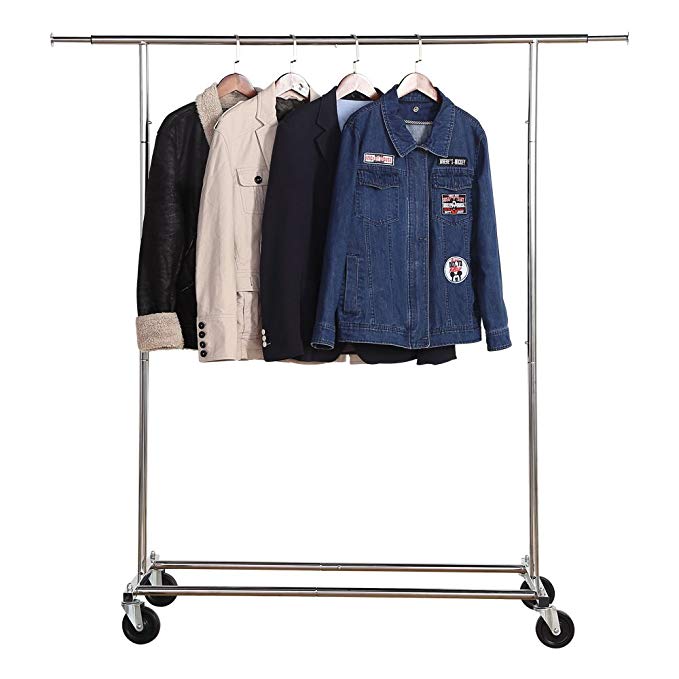
The width and height of the screenshot is (679, 679). In order to click on hangers in this screenshot , I will do `click(235, 79)`, `click(288, 86)`, `click(354, 88)`, `click(415, 85)`.